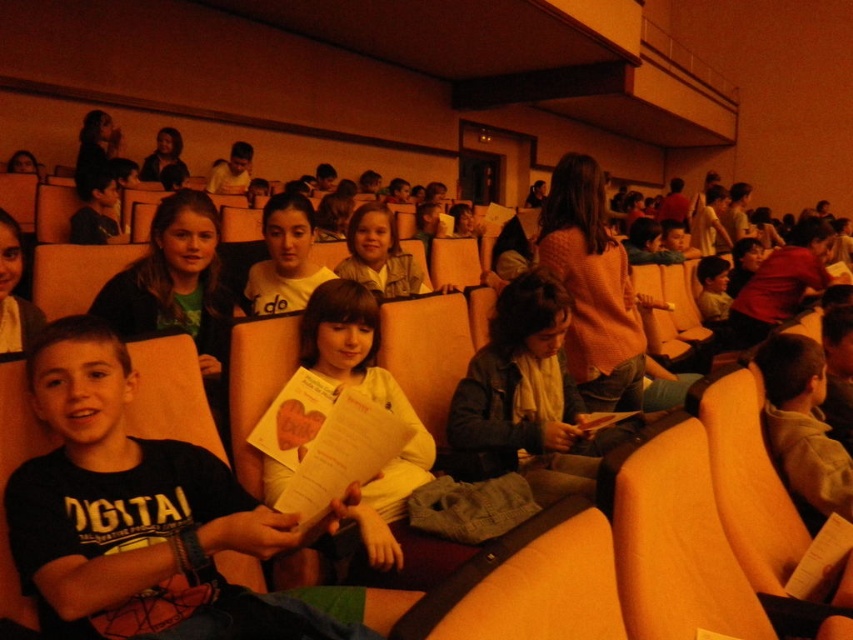
Question: Is black cotton shirt at center above white cotton shirt at upper center?

Choices:
 (A) yes
 (B) no

Answer: (B)

Question: Which point appears farthest from the camera in this image?

Choices:
 (A) (804, 285)
 (B) (717, 225)
 (C) (572, 198)
 (D) (67, 586)

Answer: (B)

Question: Based on their relative distances, which object is nearer to the white paper at center?

Choices:
 (A) matte yellow shirt at center
 (B) white cotton shirt at upper center
 (C) orange sweater at center
 (D) smooth beige sweater at center

Answer: (A)

Question: Which point is farther to the camera?

Choices:
 (A) white cotton shirt at upper center
 (B) smooth beige sweater at center

Answer: (A)

Question: Can you confirm if dark brown hair at upper left is positioned to the left of matte black jacket at upper left?

Choices:
 (A) yes
 (B) no

Answer: (A)

Question: Is matte black jacket at upper left further to the viewer compared to white cotton shirt at upper center?

Choices:
 (A) yes
 (B) no

Answer: (B)